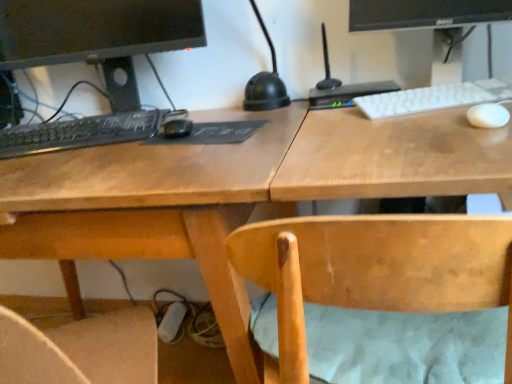
Question: Can light brown wood chair at center be found inside black matte keyboard at left, the 2th computer keyboard in the right-to-left sequence?

Choices:
 (A) no
 (B) yes

Answer: (A)

Question: Is black matte keyboard at left, the 2th computer keyboard in the right-to-left sequence, smaller than light brown wood chair at center?

Choices:
 (A) no
 (B) yes

Answer: (B)

Question: Is black matte keyboard at left, positioned as the first computer keyboard in left-to-right order, looking in the opposite direction of light brown wood chair at center?

Choices:
 (A) no
 (B) yes

Answer: (A)

Question: Considering the relative sizes of black matte keyboard at left, positioned as the first computer keyboard in left-to-right order, and light brown wood chair at center in the image provided, is black matte keyboard at left, positioned as the first computer keyboard in left-to-right order, thinner than light brown wood chair at center?

Choices:
 (A) yes
 (B) no

Answer: (A)

Question: From a real-world perspective, is black matte keyboard at left, positioned as the first computer keyboard in left-to-right order, over light brown wood chair at center?

Choices:
 (A) yes
 (B) no

Answer: (A)

Question: Would you consider black matte keyboard at left, the 2th computer keyboard in the right-to-left sequence, to be distant from light brown wood chair at center?

Choices:
 (A) no
 (B) yes

Answer: (A)

Question: Can white matte keyboard at upper right, the second computer keyboard in the left-to-right sequence, be found inside light brown wood chair at center?

Choices:
 (A) yes
 (B) no

Answer: (B)

Question: Are light brown wood chair at center and white matte keyboard at upper right, the second computer keyboard in the left-to-right sequence, beside each other?

Choices:
 (A) no
 (B) yes

Answer: (A)

Question: Can you confirm if light brown wood chair at center is thinner than white matte keyboard at upper right, the 1th computer keyboard in the right-to-left sequence?

Choices:
 (A) no
 (B) yes

Answer: (A)

Question: Considering the relative positions of light brown wood chair at center and white matte keyboard at upper right, the 1th computer keyboard in the right-to-left sequence, in the image provided, is light brown wood chair at center to the right of white matte keyboard at upper right, the 1th computer keyboard in the right-to-left sequence, from the viewer's perspective?

Choices:
 (A) yes
 (B) no

Answer: (B)

Question: Considering the relative sizes of light brown wood chair at center and white matte keyboard at upper right, the second computer keyboard in the left-to-right sequence, in the image provided, is light brown wood chair at center taller than white matte keyboard at upper right, the second computer keyboard in the left-to-right sequence,?

Choices:
 (A) yes
 (B) no

Answer: (A)

Question: Is white matte keyboard at upper right, the 1th computer keyboard in the right-to-left sequence, at the back of light brown wood chair at center?

Choices:
 (A) no
 (B) yes

Answer: (A)

Question: From the image's perspective, is black matte keyboard at left, the 2th computer keyboard in the right-to-left sequence, located above wooden desk at center?

Choices:
 (A) no
 (B) yes

Answer: (B)